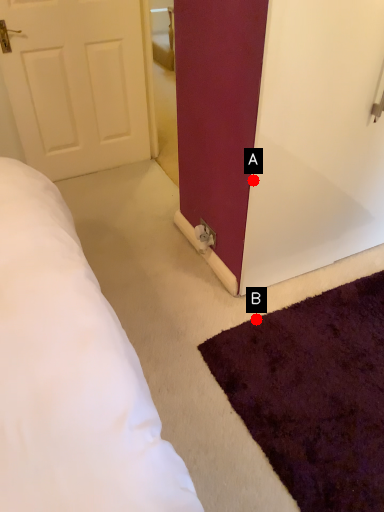
Question: Two points are circled on the image, labeled by A and B beside each circle. Which point is farther to the camera?

Choices:
 (A) A is further
 (B) B is further

Answer: (B)